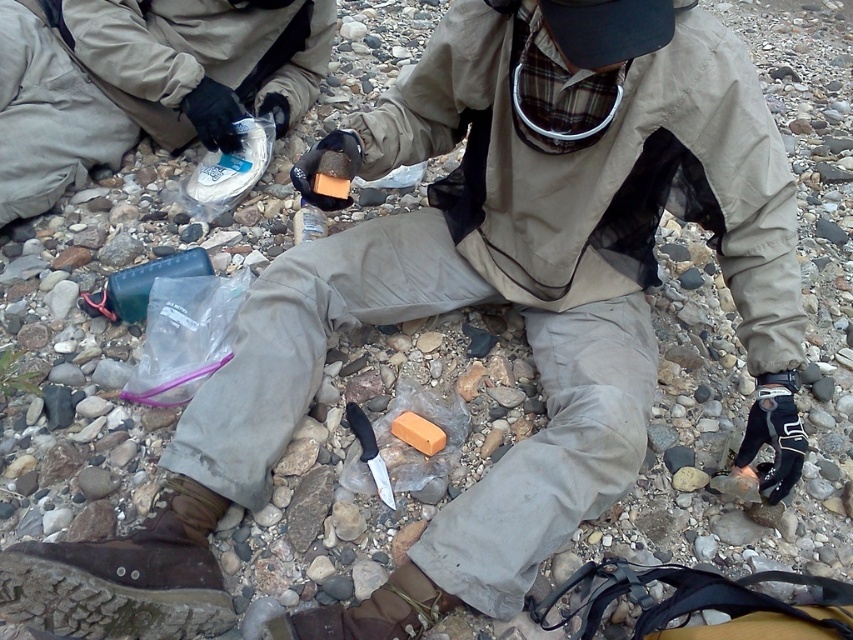
You are standing in the same position as the person in the image. You want to place a small rock sample between the matte khaki pants at center and the brown suede shoe at lower center. Which object should you place it in front of to ensure it stays visible?

You should place the small rock sample in front of the brown suede shoe at lower center because it is behind the matte khaki pants at center, so placing it in front of the shoe would keep it visible between them.

In the scene shown: You are standing at point (132, 276) and want to move to point (3, 1). Is the path directly between these two points clear of any obstacles?

Point (3, 1) is behind point (132, 276), so the path between them is blocked by the terrain or objects between those points.